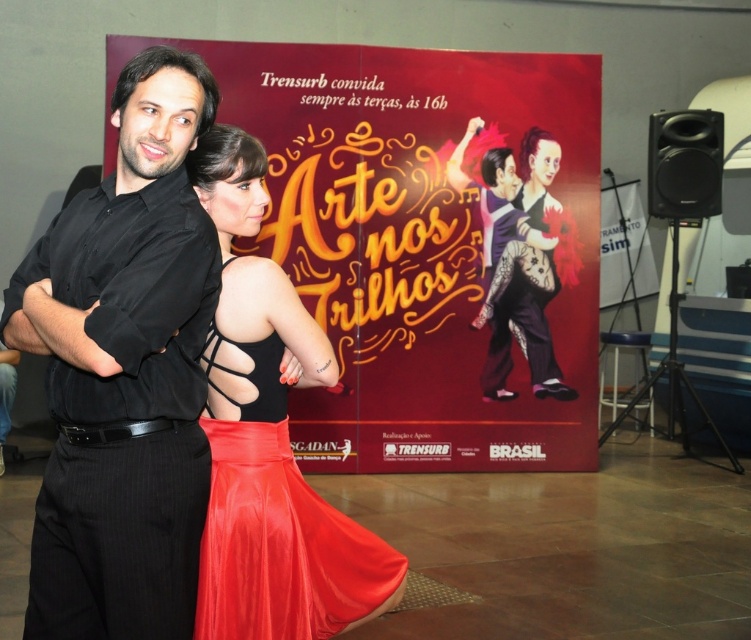
Looking at this image, is matte red poster at center in front of black pinstripe pants at left?

No, matte red poster at center is behind black pinstripe pants at left.

Measure the distance between point (385,81) and camera.

They are 5.93 meters apart.

Is point (581, 262) closer to camera compared to point (47, 369)?

No, it is behind (47, 369).

The image size is (751, 640). Identify the location of matte red poster at center. [x=421, y=243].

The width and height of the screenshot is (751, 640). Identify the location of matte red poster at center. (421, 243).

Can you confirm if matte red poster at center is shorter than smooth skin couple at center?

No, matte red poster at center is not shorter than smooth skin couple at center.

Describe the element at coordinates (421, 243) in the screenshot. I see `matte red poster at center` at that location.

Locate an element on the screen. This screenshot has height=640, width=751. matte red poster at center is located at coordinates (421, 243).

Between black pinstripe pants at left and satin red dress at center, which one appears on the right side from the viewer's perspective?

satin red dress at center

This screenshot has height=640, width=751. I want to click on black pinstripe pants at left, so click(x=124, y=371).

Image resolution: width=751 pixels, height=640 pixels. I want to click on black pinstripe pants at left, so click(x=124, y=371).